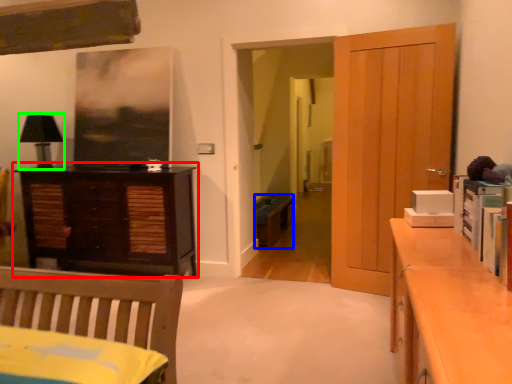
Question: Which is farther away from chest of drawers (highlighted by a red box)? cabinetry (highlighted by a blue box) or lamp (highlighted by a green box)?

Choices:
 (A) cabinetry
 (B) lamp

Answer: (A)